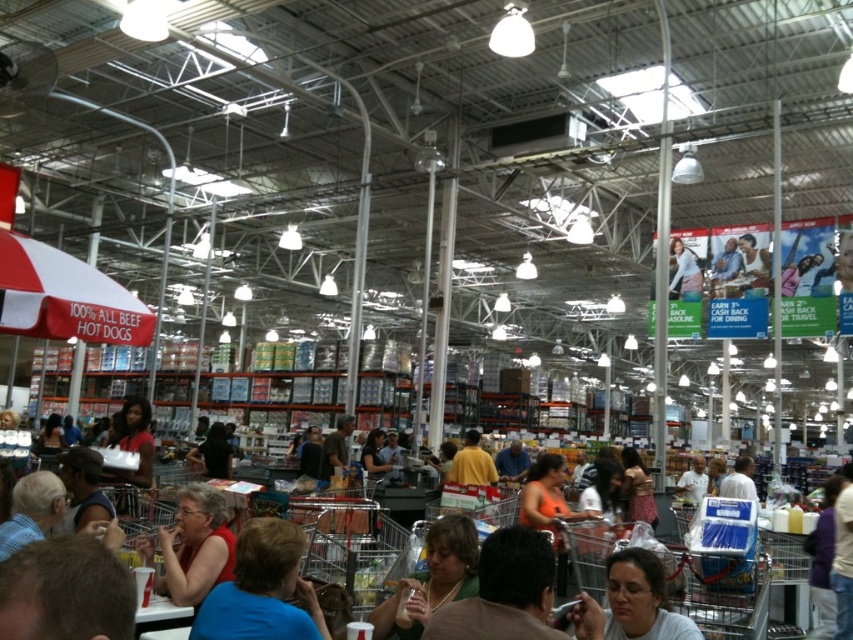
Question: Which object appears closest to the camera in this image?

Choices:
 (A) orange fabric skirt at center
 (B) red fabric shirt at center
 (C) matte red shirt at lower left
 (D) brown leather jacket at center

Answer: (D)

Question: Is the position of red fabric shirt at center more distant than that of orange fabric skirt at center?

Choices:
 (A) no
 (B) yes

Answer: (A)

Question: Which object is the closest to the matte brown shirt at center?

Choices:
 (A) matte red shirt at lower left
 (B) orange fabric skirt at center
 (C) red fabric shirt at center

Answer: (C)

Question: Estimate the real-world distances between objects in this image. Which object is farther from the red fabric shirt at center?

Choices:
 (A) matte red shirt at lower left
 (B) orange fabric shirt at center

Answer: (B)

Question: Where is brown leather jacket at center located in relation to orange fabric shirt at center in the image?

Choices:
 (A) above
 (B) below

Answer: (A)

Question: Is the position of brown leather jacket at center less distant than that of orange fabric skirt at center?

Choices:
 (A) no
 (B) yes

Answer: (B)